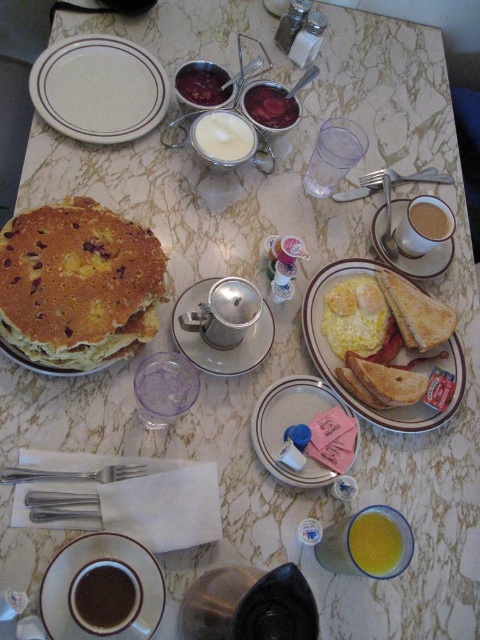
You are sitting at the marble table and want to pick up the silver metallic fork at lower left and the silvermetallicfork at right. Which fork will you reach first?

You will reach the silver metallic fork at lower left first because it is closer to you than the silvermetallicfork at right, which is further away.

Consider the image. You are setting up a dining table for a breakfast service. You have a white ceramic plate at upper left and a matte white plate at center. The distance between them is crucial for proper spacing. Can a 50 cm ruler placed between them measure the entire length without needing to bend or overlap?

The white ceramic plate at upper left and matte white plate at center are 51.14 centimeters apart. Since the ruler is only 50 cm long, it cannot fully measure the distance between them without bending or overlapping.

You are a person with a height of 6 feet standing at the table. There is a point at coordinates point (122, 112) on the table surface. Can you reach this point without moving your feet?

The distance of point (122, 112) from viewer is 38.52 inches. Since the average arm length for a 6 foot tall person is about 28 inches, you cannot reach the point without moving your feet.